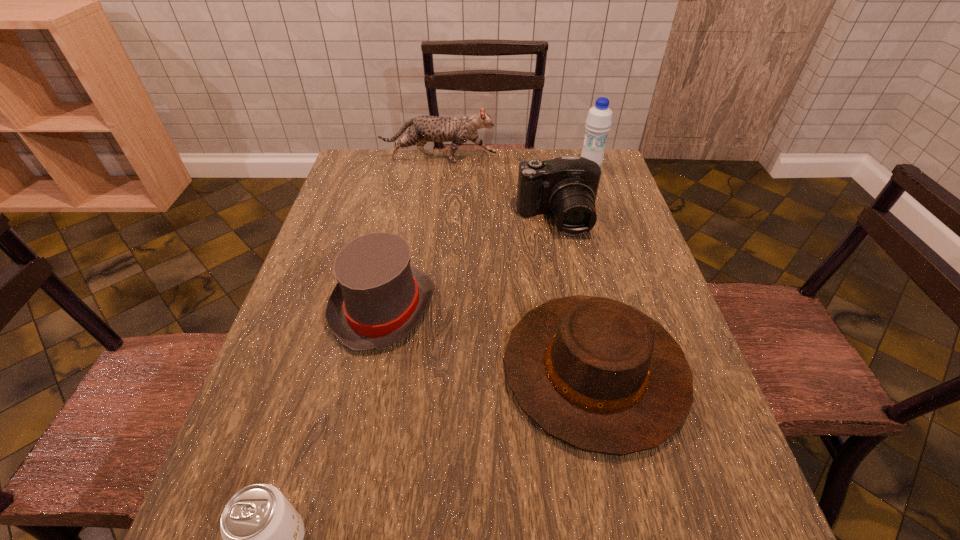
This screenshot has height=540, width=960. What are the coordinates of `vacant region that satisfies the following two spatial constraints: 1. on the lens of the camera; 2. on the left side of the cowboy hat` in the screenshot? It's located at (587, 370).

Locate an element on the screen. Image resolution: width=960 pixels, height=540 pixels. blank space that satisfies the following two spatial constraints: 1. on the back side of the tallest object; 2. on the face of the cat is located at coordinates (588, 159).

Where is `free space that satisfies the following two spatial constraints: 1. on the face of the cowboy hat; 2. on the left side of the cat`? This screenshot has height=540, width=960. free space that satisfies the following two spatial constraints: 1. on the face of the cowboy hat; 2. on the left side of the cat is located at coordinates (413, 370).

The height and width of the screenshot is (540, 960). In order to click on free point that satisfies the following two spatial constraints: 1. on the lens of the cowboy hat; 2. on the left side of the third farthest object in this screenshot , I will do `click(587, 370)`.